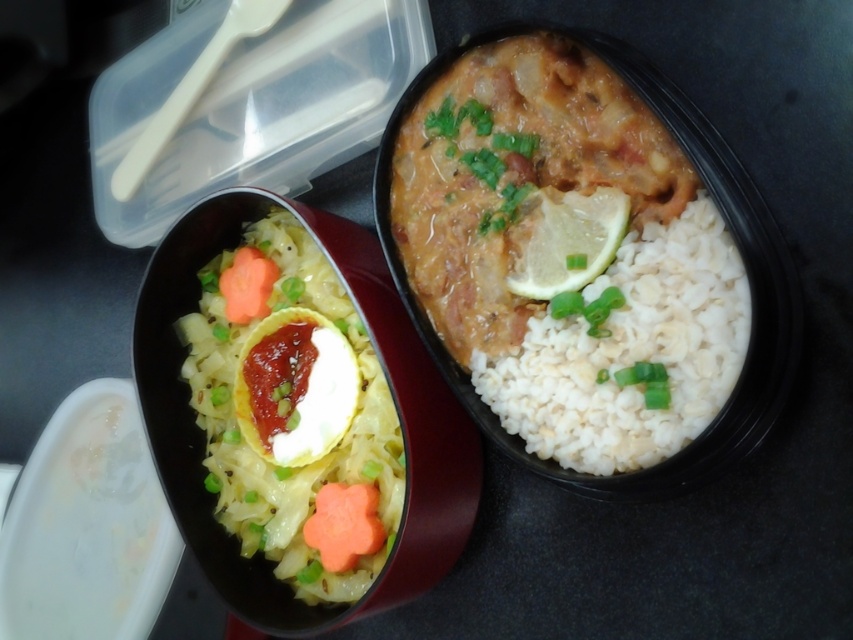
You are a food stylist arranging ingredients on a bento plate. You have a yellow matte lemon at upper right and a green chopped onion at center. Which ingredient is positioned more to the left?

The yellow matte lemon at upper right is positioned more to the left than the green chopped onion at center.

You are a food critic evaluating the presentation of two bento meals. Looking at the white matte rice at center and the green chopped onion at center, which one appears closer to you in the image?

The white matte rice at center is in front of the green chopped onion at center, so it appears closer to you.

Based on the scene, which object is taller when comparing the white matte rice at center and the green leafy vegetable at center?

The white matte rice at center is much taller than the green leafy vegetable at center.